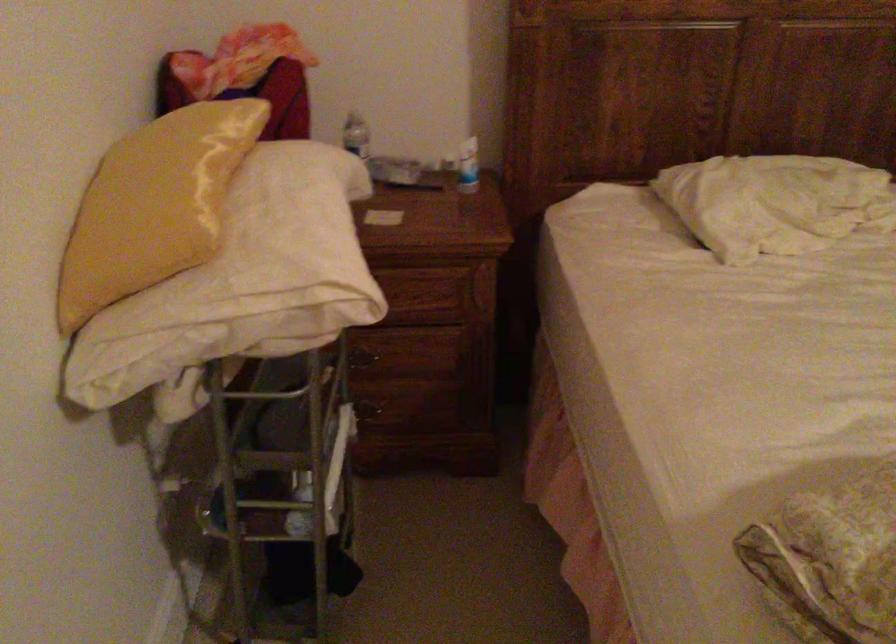
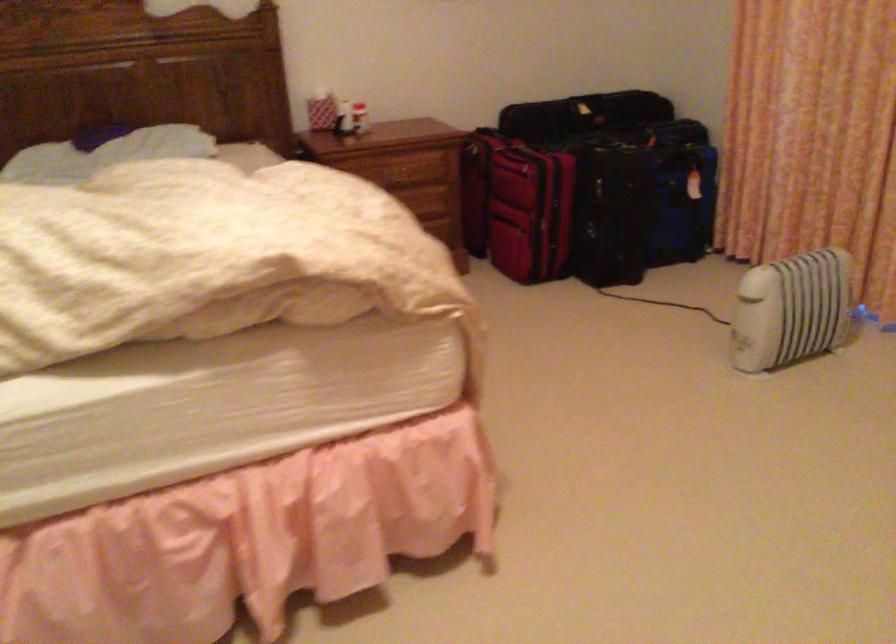
In a continuous first-person perspective shot, in which direction is the camera moving?

The cameraman walked toward right, backward.